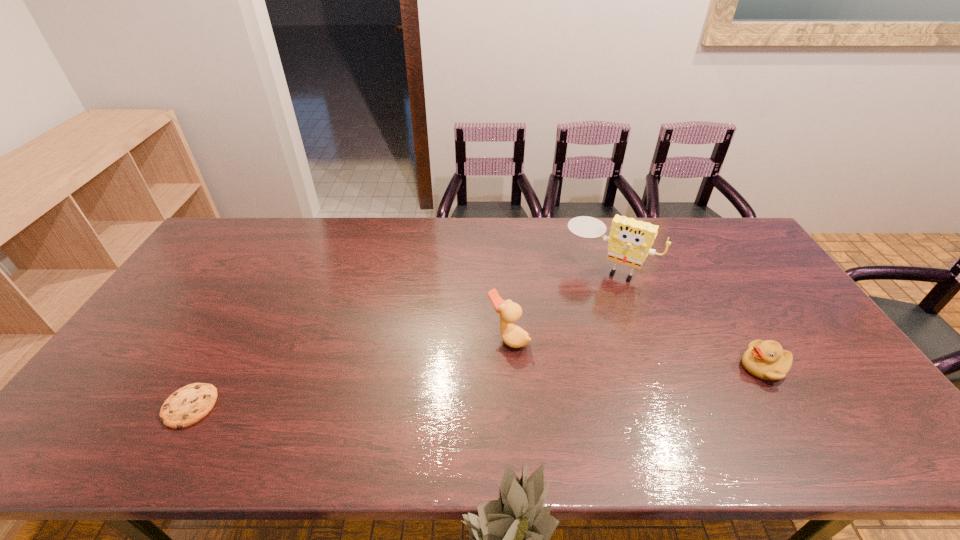
The image size is (960, 540). I want to click on free space that is in between the leftmost object and the rightmost object, so click(x=476, y=387).

Image resolution: width=960 pixels, height=540 pixels. I want to click on unoccupied area between the duck and the leftmost object, so click(348, 372).

The width and height of the screenshot is (960, 540). What are the coordinates of `free area in between the duck and the second shortest object` in the screenshot? It's located at (636, 352).

Find the location of a particular element. This screenshot has width=960, height=540. blank region between the cookie and the second tallest object is located at coordinates (348, 372).

Where is `free point between the rightmost object and the sponge`? free point between the rightmost object and the sponge is located at coordinates (684, 317).

I want to click on free space between the third object from right to left and the duckling, so click(636, 352).

At what (x,y) coordinates should I click in order to perform the action: click on empty space that is in between the sponge and the shortest object. Please return your answer as a coordinate pair (x, y). The width and height of the screenshot is (960, 540). Looking at the image, I should click on (398, 337).

At what (x,y) coordinates should I click in order to perform the action: click on free space that is in between the duck and the duckling. Please return your answer as a coordinate pair (x, y). The height and width of the screenshot is (540, 960). Looking at the image, I should click on (636, 352).

Find the location of `object that is the third closest to the tallest object`. object that is the third closest to the tallest object is located at coordinates (188, 405).

Identify the location of object that is the closest to the sponge. Image resolution: width=960 pixels, height=540 pixels. (512, 335).